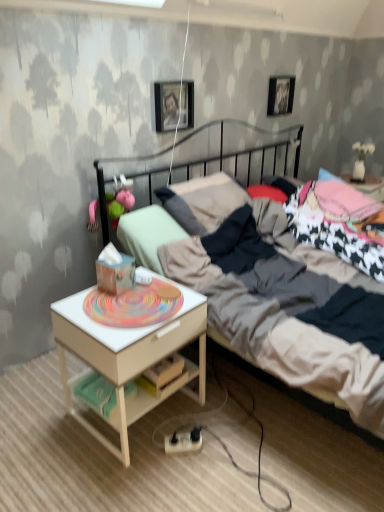
This screenshot has width=384, height=512. In order to click on vacant area to the left of white wood nightstand at lower left in this screenshot , I will do `click(38, 421)`.